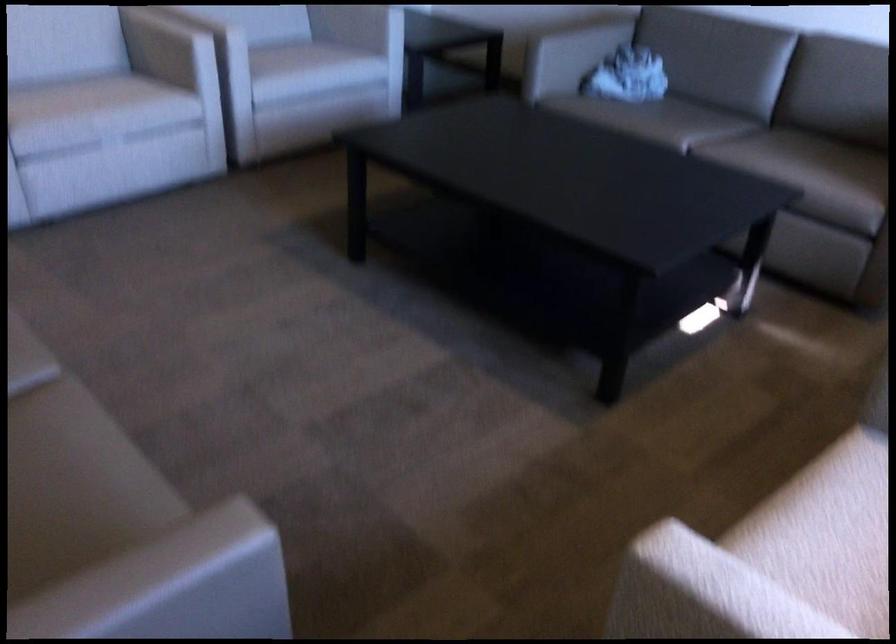
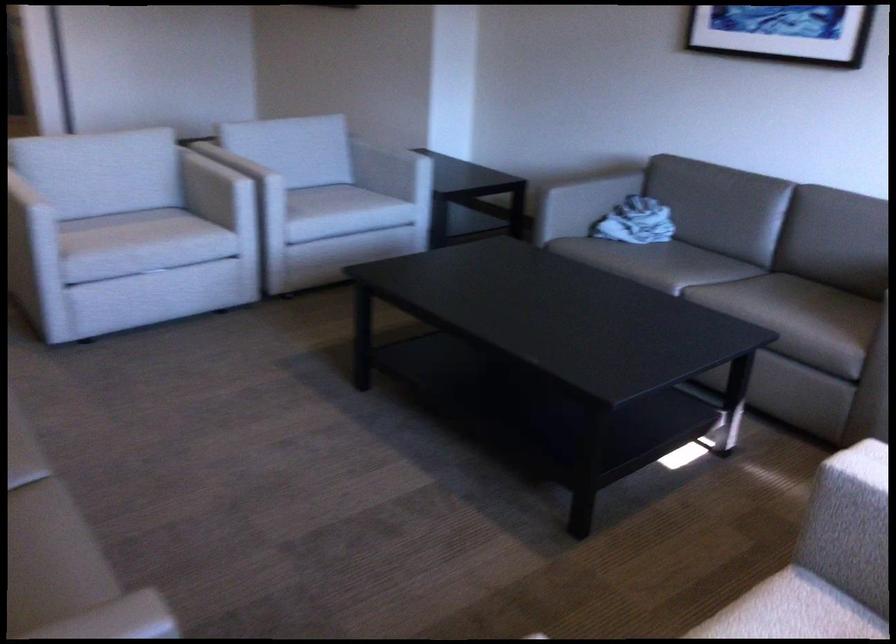
In a continuous first-person perspective shot, in which direction is the camera moving?

The movement direction of the cameraman is right, backward.